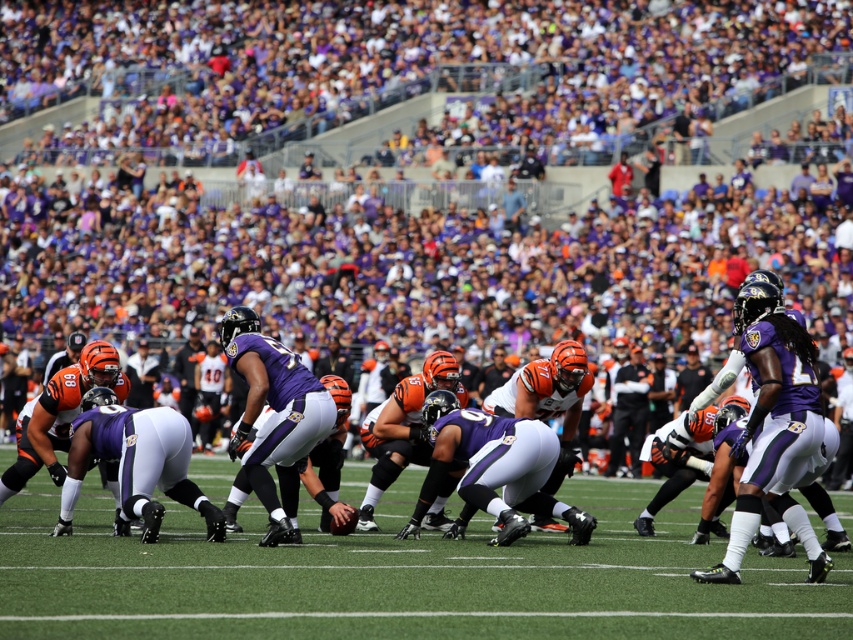
You are a photographer standing at the edge of the field, 50 feet away from the purple matte jersey at center. You want to take a closeup shot of the jersey. Do you think your camera can zoom in enough to capture the jersey clearly?

The purple matte jersey at center is 46.66 feet away from the viewer, so yes, the camera can zoom in enough to capture the purple matte jersey at center clearly since it is closer than the photographer estimated distance of 50 feet.

In the scene shown: You are a sports analyst watching the game. You notice the purple matte jersey at center and the green artificial turf at center. Which object is wider?

The purple matte jersey at center is wider than the green artificial turf at center.

You are a referee standing at the edge of the field. You see the purple matte jersey at center and the green artificial turf at center. Which object is closer to the left side of the field?

The purple matte jersey at center is closer to the left side of the field because it is positioned to the left of the green artificial turf at center.